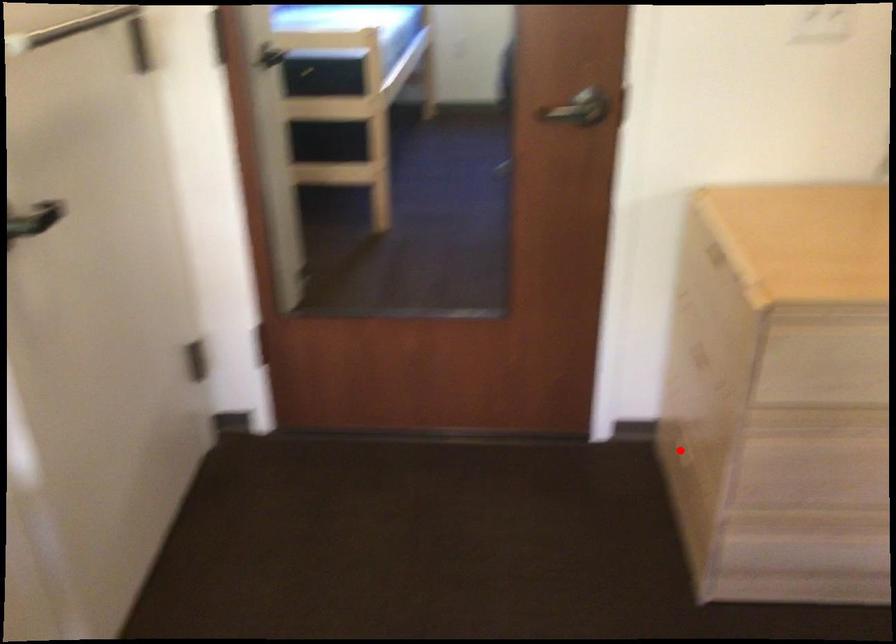
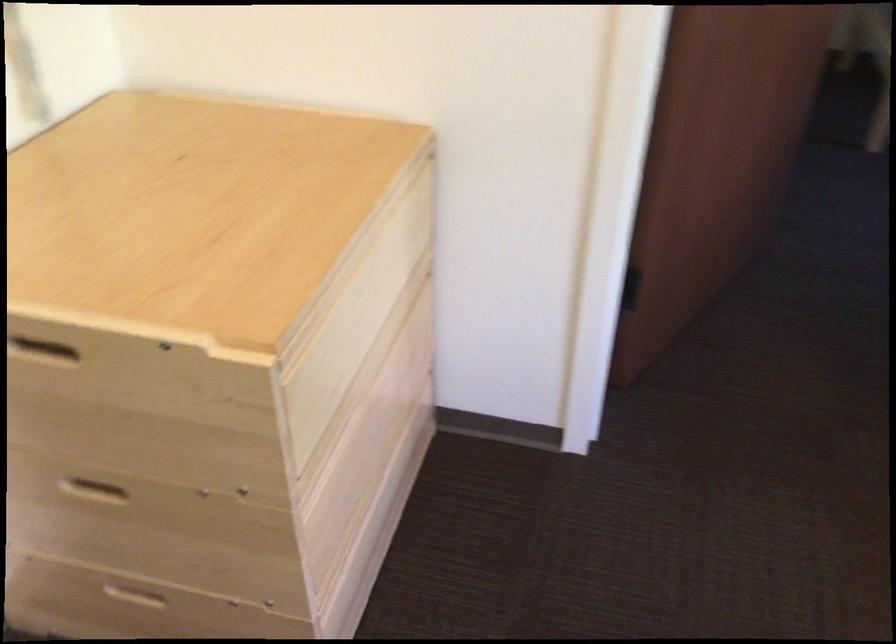
Question: I am providing you with two images of the same scene from different viewpoints. A red point is shown in image1. For the corresponding object point in image2, is it positioned nearer or farther from the camera?

Choices:
 (A) Nearer
 (B) Farther

Answer: (A)